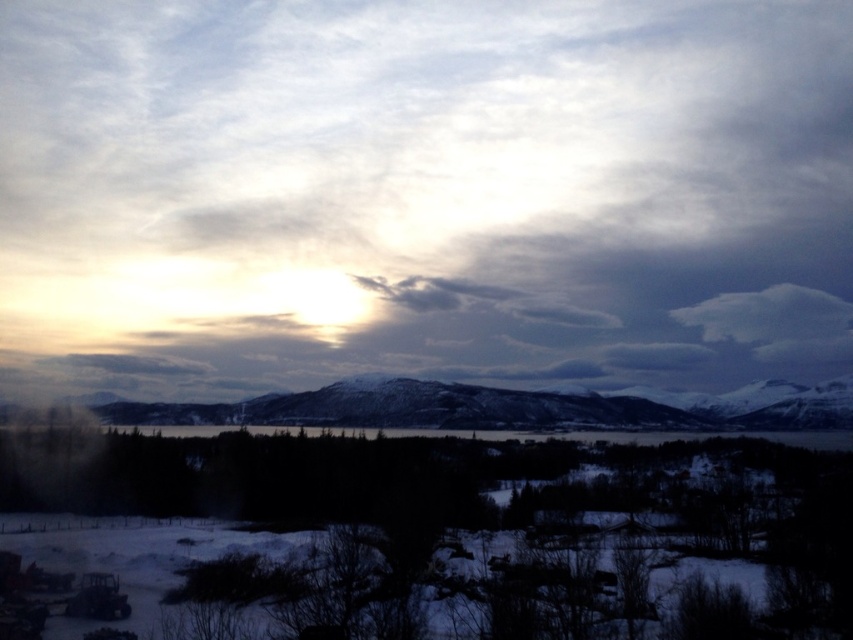
Based on the scene, can you determine which object is wider between the white fluffy cloud at upper center and the snowy rock formation at center?

The white fluffy cloud at upper center is wider than the snowy rock formation at center according to the description.

You are an artist planning to paint the winter landscape. You want to emphasize the contrast between the white fluffy cloud at upper center and the snowy rock formation at center. Which object should you make larger in your painting to achieve this effect?

To emphasize the contrast between the white fluffy cloud at upper center and the snowy rock formation at center, you should make the white fluffy cloud at upper center larger in your painting since it already has a larger size compared to the snowy rock formation at center.